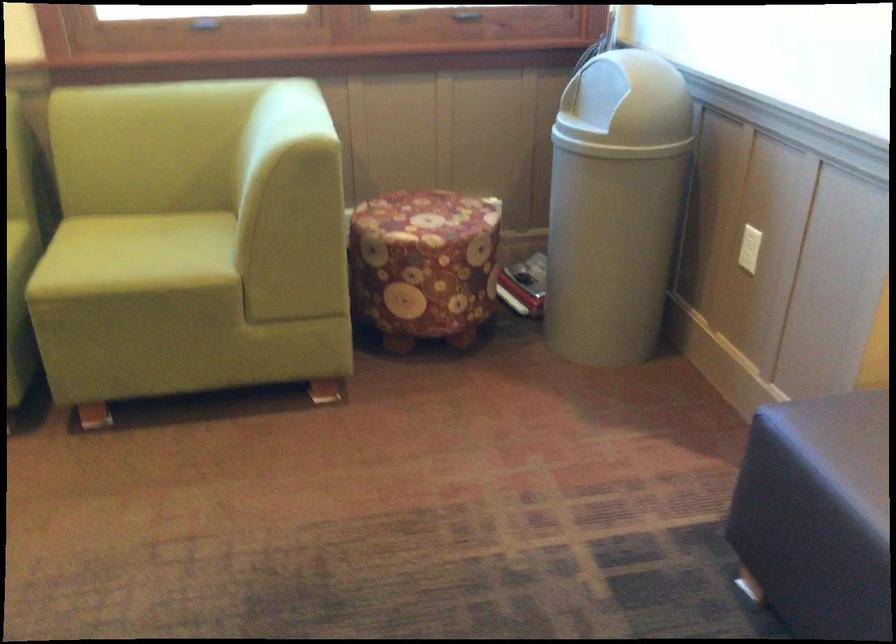
Locate an element on the screen. The image size is (896, 644). green chair sitting surface is located at coordinates (142, 252).